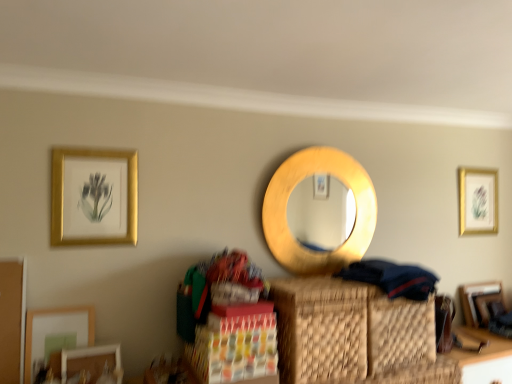
Question: Is woven brown basket at center thinner than matte white picture frame at lower left, arranged as the fifth picture frame when viewed from the back?

Choices:
 (A) no
 (B) yes

Answer: (A)

Question: From a real-world perspective, is woven brown basket at center over matte white picture frame at lower left, the 3th picture frame when ordered from right to left?

Choices:
 (A) yes
 (B) no

Answer: (A)

Question: From the image's perspective, is woven brown basket at center on top of matte white picture frame at lower left, arranged as the first picture frame when viewed from the front?

Choices:
 (A) no
 (B) yes

Answer: (B)

Question: From a real-world perspective, is woven brown basket at center under matte white picture frame at lower left, arranged as the fifth picture frame when viewed from the back?

Choices:
 (A) no
 (B) yes

Answer: (A)

Question: Considering the relative sizes of woven brown basket at center and matte white picture frame at lower left, the 3th picture frame when ordered from right to left, in the image provided, is woven brown basket at center shorter than matte white picture frame at lower left, the 3th picture frame when ordered from right to left,?

Choices:
 (A) no
 (B) yes

Answer: (A)

Question: In terms of height, does matte white picture frame at lower left, the 3th picture frame when ordered from right to left, look taller or shorter compared to woven brown basket at center?

Choices:
 (A) tall
 (B) short

Answer: (B)

Question: Is matte white picture frame at lower left, arranged as the fifth picture frame when viewed from the back, inside or outside of woven brown basket at center?

Choices:
 (A) outside
 (B) inside

Answer: (A)

Question: Is matte white picture frame at lower left, the 3th picture frame when ordered from right to left, wider or thinner than woven brown basket at center?

Choices:
 (A) thin
 (B) wide

Answer: (A)

Question: From a real-world perspective, is matte white picture frame at lower left, the 3th picture frame when ordered from right to left, positioned above or below woven brown basket at center?

Choices:
 (A) above
 (B) below

Answer: (B)

Question: Considering the positions of wooden picture frame at lower right, which ranks as the second picture frame in right-to-left order, and woven brown basket at center in the image, is wooden picture frame at lower right, which ranks as the second picture frame in right-to-left order, bigger or smaller than woven brown basket at center?

Choices:
 (A) small
 (B) big

Answer: (A)

Question: Is wooden picture frame at lower right, which is the 4th picture frame from left to right, spatially inside woven brown basket at center, or outside of it?

Choices:
 (A) inside
 (B) outside

Answer: (B)

Question: From the image's perspective, is wooden picture frame at lower right, which is the 4th picture frame from left to right, above or below woven brown basket at center?

Choices:
 (A) below
 (B) above

Answer: (A)

Question: Considering their positions, is wooden picture frame at lower right, which ranks as the second picture frame in right-to-left order, located in front of or behind woven brown basket at center?

Choices:
 (A) behind
 (B) front

Answer: (A)

Question: Visually, is wooden table at lower right positioned to the left or to the right of dark blue fabric at lower right?

Choices:
 (A) right
 (B) left

Answer: (A)

Question: From a real-world perspective, is wooden table at lower right positioned above or below dark blue fabric at lower right?

Choices:
 (A) below
 (B) above

Answer: (A)